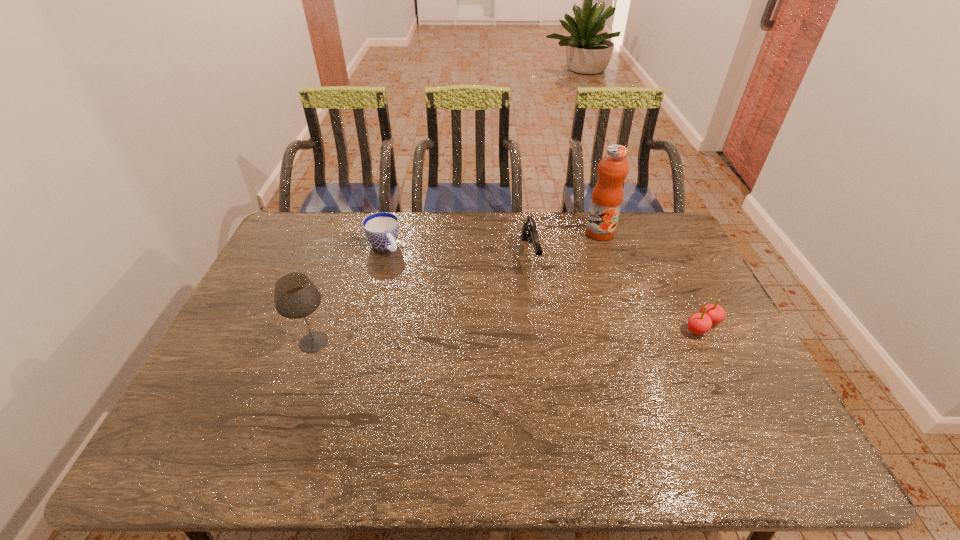
The image size is (960, 540). I want to click on vacant region located 0.130m at the end of the barrel of the third shortest object, so (541, 307).

At what (x,y) coordinates should I click in order to perform the action: click on vacant space located 0.180m at the end of the barrel of the third shortest object. Please return your answer as a coordinate pair (x, y). Looking at the image, I should click on (544, 319).

Image resolution: width=960 pixels, height=540 pixels. I want to click on free point located at the end of the barrel of the third shortest object, so click(x=551, y=343).

What are the coordinates of `free point located 0.080m on the side of the fourth object from right to left with the handle` in the screenshot? It's located at (403, 268).

This screenshot has width=960, height=540. I want to click on free spot located 0.090m on the side of the fourth object from right to left with the handle, so click(404, 270).

Where is `free space located 0.130m on the side of the fourth object from right to left with the handle`? This screenshot has width=960, height=540. free space located 0.130m on the side of the fourth object from right to left with the handle is located at coordinates (410, 277).

You are a GUI agent. You are given a task and a screenshot of the screen. Output one action in this format:
    pyautogui.click(x=<x>, y=<y>)
    Task: Click on the vacant space situated 0.320m on the front label of the second object from right to left
    
    Given the screenshot: What is the action you would take?
    pyautogui.click(x=564, y=296)

This screenshot has width=960, height=540. Identify the location of vacant space located on the front label of the second object from right to left. (575, 277).

Where is `free region located 0.090m on the front label of the second object from right to left`? free region located 0.090m on the front label of the second object from right to left is located at coordinates (588, 255).

The height and width of the screenshot is (540, 960). Identify the location of gun that is at the far edge. (529, 231).